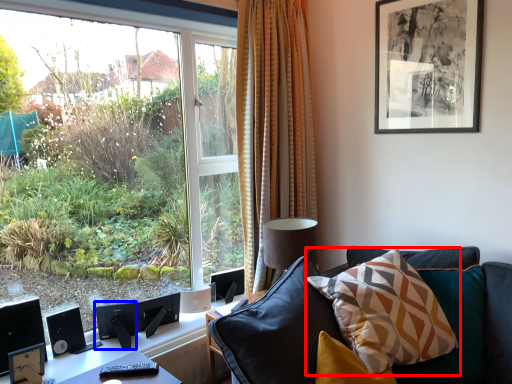
Question: Which object appears farthest to the camera in this image, pillow (highlighted by a red box) or speaker (highlighted by a blue box)?

Choices:
 (A) pillow
 (B) speaker

Answer: (B)